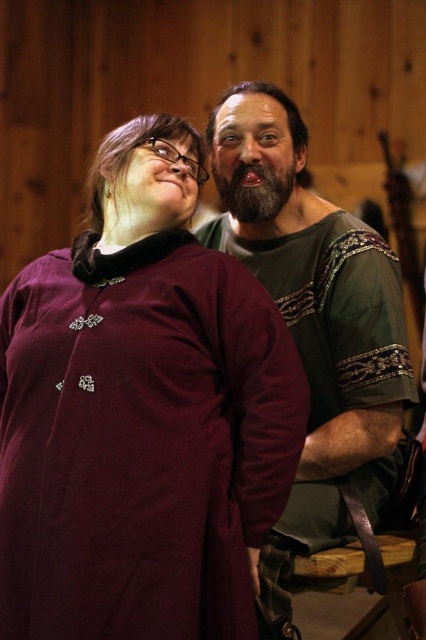
Question: Can you confirm if maroon fabric dress at center is thinner than green woven shirt at right?

Choices:
 (A) no
 (B) yes

Answer: (A)

Question: Is maroon fabric dress at center wider than green woven shirt at right?

Choices:
 (A) yes
 (B) no

Answer: (A)

Question: Which object is closer to the camera taking this photo?

Choices:
 (A) maroon fabric dress at center
 (B) green woven shirt at right

Answer: (A)

Question: Does maroon fabric dress at center lie behind green woven shirt at right?

Choices:
 (A) no
 (B) yes

Answer: (A)

Question: Which point is farther to the camera?

Choices:
 (A) green woven shirt at right
 (B) maroon fabric dress at center

Answer: (A)